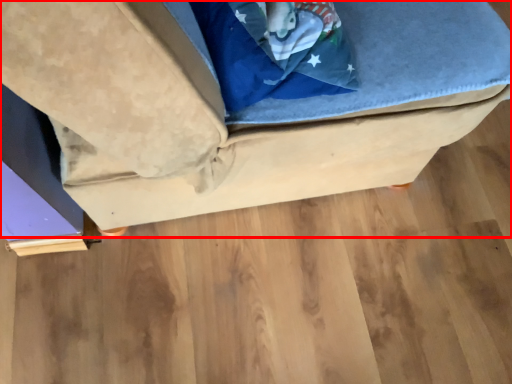
Question: In this image, where is furniture (annotated by the red box) located relative to wood?

Choices:
 (A) right
 (B) left

Answer: (B)